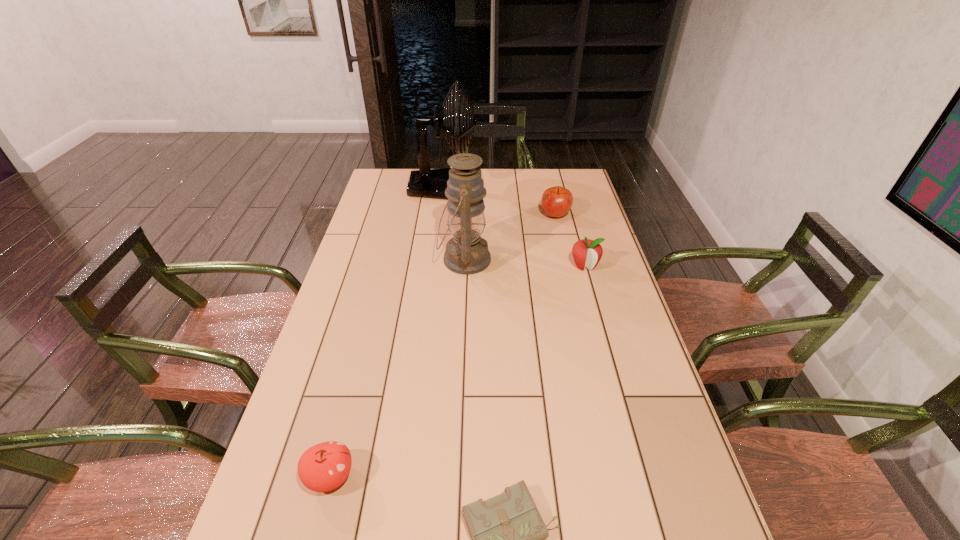
Locate an element on the screen. The width and height of the screenshot is (960, 540). free space between the farthest object and the leftmost apple is located at coordinates (387, 332).

The image size is (960, 540). In order to click on free space between the oil lamp and the second farthest apple in this screenshot , I will do `click(524, 262)`.

The image size is (960, 540). I want to click on vacant point located between the fifth nearest object and the oil lamp, so 510,237.

Find the location of a particular element. free point between the leftmost apple and the farthest apple is located at coordinates point(443,346).

Find the location of a particular element. The height and width of the screenshot is (540, 960). free space between the nearest apple and the farthest apple is located at coordinates (443, 346).

I want to click on vacant area between the fifth nearest object and the farthest object, so click(x=499, y=201).

Select which object is the third closest to the diary. Please provide its 2D coordinates. Your answer should be formatted as a tuple, i.e. [(x, y)], where the tuple contains the x and y coordinates of a point satisfying the conditions above.

[(587, 253)]

Identify which object is the closest to the farthest object. Please provide its 2D coordinates. Your answer should be formatted as a tuple, i.e. [(x, y)], where the tuple contains the x and y coordinates of a point satisfying the conditions above.

[(467, 252)]

Locate an element on the screen. The image size is (960, 540). apple that is the third closest one to the shortest object is located at coordinates tap(556, 201).

In order to click on apple that is the second closest one to the nearest apple in this screenshot , I will do `click(556, 201)`.